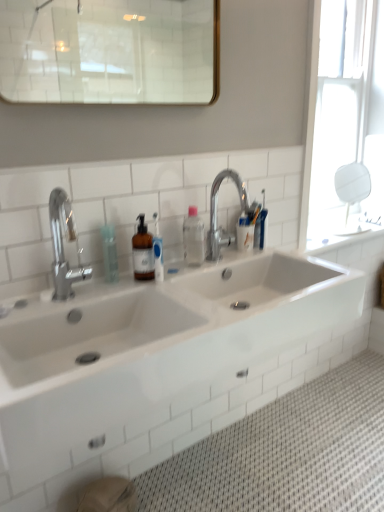
What is the approximate width of white glossy sink at center?

white glossy sink at center is 20.95 inches in width.

What is the approximate width of transparent glass mirror at upper right?

2.35 inches.

This screenshot has height=512, width=384. Describe the element at coordinates (110, 254) in the screenshot. I see `transparent plastic bottle at center` at that location.

Measure the distance between point (195, 70) and camera.

Point (195, 70) is 3.54 meters from camera.

Locate an element on the screen. The width and height of the screenshot is (384, 512). polished chrome faucet at left, the 1th tap when ordered from left to right is located at coordinates (62, 245).

From a real-world perspective, relative to white glass mirror at upper center, is white glossy sink at center vertically above or below?

From a real-world perspective, white glossy sink at center is physically below white glass mirror at upper center.

Is white glossy sink at center directly adjacent to white glass mirror at upper center?

There is a gap between white glossy sink at center and white glass mirror at upper center.

From the picture: Which point is more distant from viewer, (95,365) or (16,3)?

The point (16,3) is farther.

Which object is thinner, white glossy sink at center or white glass mirror at upper center?

Thinner between the two is white glass mirror at upper center.

Which is behind, point (215, 240) or point (334, 76)?

The point (334, 76) is farther from the camera.

From the picture: Is silver metallic faucet at upper center, arranged as the second tap when viewed from the left, to the right of transparent glass mirror at upper right from the viewer's perspective?

No.

Between silver metallic faucet at upper center, which is counted as the first tap, starting from the right, and transparent glass mirror at upper right, which one has larger size?

transparent glass mirror at upper right.

Would you consider silver metallic faucet at upper center, which is the 2th tap from front to back, to be distant from transparent glass mirror at upper right?

Actually, silver metallic faucet at upper center, which is the 2th tap from front to back, and transparent glass mirror at upper right are a little close together.

From a real-world perspective, relative to polished chrome faucet at left, placed as the first tap when sorted from front to back, is transparent glass mirror at upper right vertically above or below?

transparent glass mirror at upper right is situated higher than polished chrome faucet at left, placed as the first tap when sorted from front to back, in the real world.

Which object is thinner, transparent glass mirror at upper right or polished chrome faucet at left, placed as the first tap when sorted from front to back?

transparent glass mirror at upper right.

Is transparent glass mirror at upper right not inside polished chrome faucet at left, the 1th tap when ordered from left to right?

Yes, transparent glass mirror at upper right is outside of polished chrome faucet at left, the 1th tap when ordered from left to right.

Can you confirm if white glossy sink at center is taller than transparent plastic bottle at center?

Indeed, white glossy sink at center has a greater height compared to transparent plastic bottle at center.

Which is behind, white glossy sink at center or transparent plastic bottle at center?

transparent plastic bottle at center is further from the camera.

Considering the relative sizes of white glossy sink at center and transparent plastic bottle at center in the image provided, is white glossy sink at center thinner than transparent plastic bottle at center?

In fact, white glossy sink at center might be wider than transparent plastic bottle at center.

Find the location of a particular element. toiletry in front of the transparent plastic bottle at center is located at coordinates (110, 254).

Can you confirm if transparent plastic bottle at center is shorter than transparent plastic bottle at center?

Incorrect, the height of transparent plastic bottle at center does not fall short of that of transparent plastic bottle at center.

From a real-world perspective, is transparent plastic bottle at center on transparent plastic bottle at center?

Yes, from a real-world perspective, transparent plastic bottle at center is above transparent plastic bottle at center.

Is transparent plastic bottle at center bigger than transparent plastic bottle at center?

Correct, transparent plastic bottle at center is larger in size than transparent plastic bottle at center.

Is transparent glass mirror at upper right positioned with its back to transparent plastic bottle at center?

No.

How distant is transparent glass mirror at upper right from transparent plastic bottle at center?

transparent glass mirror at upper right is 3.72 feet away from transparent plastic bottle at center.

Considering the relative sizes of transparent glass mirror at upper right and transparent plastic bottle at center in the image provided, is transparent glass mirror at upper right thinner than transparent plastic bottle at center?

Correct, the width of transparent glass mirror at upper right is less than that of transparent plastic bottle at center.

How many degrees apart are the facing directions of transparent glass mirror at upper right and transparent plastic bottle at center?

transparent glass mirror at upper right and transparent plastic bottle at center are facing 0.551 degrees away from each other.

Considering the relative sizes of polished chrome faucet at left, which appears as the 2th tap when viewed from the right, and white glossy sink at center in the image provided, is polished chrome faucet at left, which appears as the 2th tap when viewed from the right, wider than white glossy sink at center?

Incorrect, the width of polished chrome faucet at left, which appears as the 2th tap when viewed from the right, does not surpass that of white glossy sink at center.

Is polished chrome faucet at left, placed as the first tap when sorted from front to back, located outside white glossy sink at center?

polished chrome faucet at left, placed as the first tap when sorted from front to back, lies outside white glossy sink at center's area.

How distant is polished chrome faucet at left, the 1th tap when ordered from left to right, from white glossy sink at center?

polished chrome faucet at left, the 1th tap when ordered from left to right, and white glossy sink at center are 34.19 centimeters apart from each other.

Where is `tap on the left of white glossy sink at center`? tap on the left of white glossy sink at center is located at coordinates (62, 245).

This screenshot has height=512, width=384. I want to click on sink on the right of the white glass mirror at upper center, so click(158, 362).

Locate an element on the screen. window that is above the silver metallic faucet at upper center, which ranks as the 1th tap in back-to-front order (from a real-world perspective) is located at coordinates (343, 112).

Looking at the image, which one is located closer to white glass mirror at upper center, white glossy sink at center or transparent plastic bottle at center?

transparent plastic bottle at center is positioned closer to the anchor white glass mirror at upper center.

Looking at this image, from the image, which object appears to be nearer to transparent glass mirror at upper right, white glossy sink at center or transparent plastic bottle at center?

white glossy sink at center lies closer to transparent glass mirror at upper right than the other object.

From the picture: Considering their positions, is polished chrome faucet at left, placed as the first tap when sorted from front to back, positioned further to white glossy sink at center than transparent plastic bottle at center?

transparent plastic bottle at center is positioned further to the anchor white glossy sink at center.

When comparing their distances from silver metallic faucet at upper center, arranged as the second tap when viewed from the left, does white glossy sink at center or transparent plastic bottle at center seem further?

Among the two, transparent plastic bottle at center is located further to silver metallic faucet at upper center, arranged as the second tap when viewed from the left.

Considering their positions, is white glass mirror at upper center positioned closer to silver metallic faucet at upper center, arranged as the second tap when viewed from the left, than transparent plastic bottle at center?

The object closer to silver metallic faucet at upper center, arranged as the second tap when viewed from the left, is transparent plastic bottle at center.

Based on their spatial positions, is white glass mirror at upper center or polished chrome faucet at left, which appears as the 2th tap when viewed from the right, further from transparent plastic bottle at center?

white glass mirror at upper center lies further to transparent plastic bottle at center than the other object.

Based on their spatial positions, is white glossy sink at center or transparent glass mirror at upper right further from polished chrome faucet at left, which appears as the 2th tap when viewed from the right?

Among the two, transparent glass mirror at upper right is located further to polished chrome faucet at left, which appears as the 2th tap when viewed from the right.

Looking at the image, which one is located further to transparent plastic bottle at center, transparent plastic bottle at center or white glossy sink at center?

white glossy sink at center is further to transparent plastic bottle at center.

This screenshot has height=512, width=384. I want to click on bottle situated between transparent plastic bottle at center and silver metallic faucet at upper center, which is counted as the first tap, starting from the right, from left to right, so click(193, 238).

At what (x,y) coordinates should I click in order to perform the action: click on bottle situated between white glass mirror at upper center and transparent glass mirror at upper right from left to right. Please return your answer as a coordinate pair (x, y). Looking at the image, I should click on (193, 238).

Where is `toiletry between polished chrome faucet at left, which is the 2th tap in back-to-front order, and silver metallic faucet at upper center, which is the 2th tap from front to back, from left to right`? This screenshot has height=512, width=384. toiletry between polished chrome faucet at left, which is the 2th tap in back-to-front order, and silver metallic faucet at upper center, which is the 2th tap from front to back, from left to right is located at coordinates (110, 254).

The width and height of the screenshot is (384, 512). Find the location of `mirror situated between transparent plastic bottle at center and transparent glass mirror at upper right from left to right`. mirror situated between transparent plastic bottle at center and transparent glass mirror at upper right from left to right is located at coordinates (108, 51).